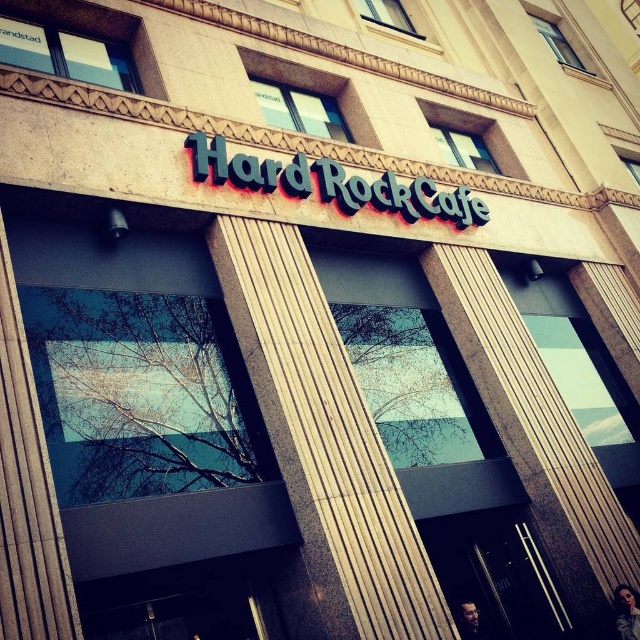
You are standing in front of the Hard Rock Cafe entrance. You notice two points marked on the building facade. The first point is at coordinate point [432,618], and the second is at point [193,148]. Which of these two points is nearer to you?

Point [432,618] is closer to the viewer than point [193,148].

Consider the image. You are standing in front of the Hard Rock Cafe entrance and want to take a photo of the blue metallic sign at center without the wooden pillar at center blocking it. Which direction should you move to ensure the pillar is out of frame?

Move to the right side of the entrance so that the wooden pillar at center is no longer blocking the view of the blue metallic sign at center.